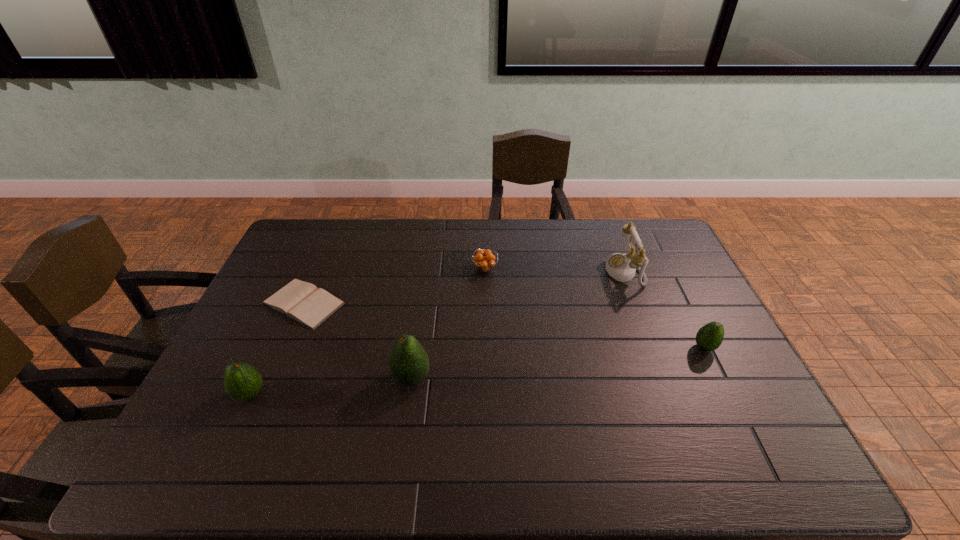
Where is `free point between the fourth farthest object and the leftmost avocado`? The width and height of the screenshot is (960, 540). free point between the fourth farthest object and the leftmost avocado is located at coordinates click(477, 371).

Where is `vacant area that lies between the fourth tallest object and the tallest avocado`? vacant area that lies between the fourth tallest object and the tallest avocado is located at coordinates tap(558, 362).

Where is `object identified as the third closest to the second shortest object`? This screenshot has width=960, height=540. object identified as the third closest to the second shortest object is located at coordinates (301, 301).

You are a GUI agent. You are given a task and a screenshot of the screen. Output one action in this format:
    pyautogui.click(x=<x>, y=<y>)
    Task: Click on the object that is the second closest to the second avocado from left to right
    
    Given the screenshot: What is the action you would take?
    pyautogui.click(x=242, y=381)

Identify the location of avocado that stands as the second closest to the fourth farthest object. The height and width of the screenshot is (540, 960). (242, 381).

The width and height of the screenshot is (960, 540). Identify the location of avocado that is the second closest one to the third object from right to left. (709, 337).

Locate an element on the screen. free point that satisfies the following two spatial constraints: 1. on the back side of the fifth tallest object; 2. on the left side of the Bible is located at coordinates (319, 268).

What are the coordinates of `vacant point that satisfies the following two spatial constraints: 1. on the back side of the shortest avocado; 2. on the left side of the tallest avocado` in the screenshot? It's located at (416, 347).

Where is `vacant space that satisfies the following two spatial constraints: 1. on the dial of the second object from right to left; 2. on the left side of the shortest avocado`? The height and width of the screenshot is (540, 960). vacant space that satisfies the following two spatial constraints: 1. on the dial of the second object from right to left; 2. on the left side of the shortest avocado is located at coordinates (654, 347).

Locate an element on the screen. This screenshot has height=540, width=960. vacant point that satisfies the following two spatial constraints: 1. on the back side of the third nearest object; 2. on the right side of the fourth object from right to left is located at coordinates coord(416,347).